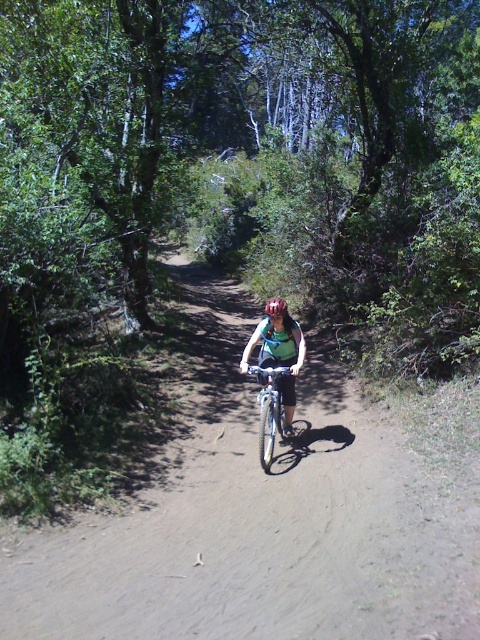
You are standing at the point marked by the coordinates point [271,412], which marks silver metallic bicycle at center. Can you see the silver metallic bicycle at center from this position?

Yes, the point marked by the coordinates point [271,412] marks the silver metallic bicycle at center, so you are standing exactly at the location of the silver metallic bicycle at center. Therefore, you can see the silver metallic bicycle at center from this position.

You are a photographer trying to capture a photo of the scene. You notice the matte green shirt at center and the silver metallic bicycle at center. Which object takes up more horizontal space in the image?

The matte green shirt at center takes up more horizontal space than the silver metallic bicycle at center because its width is larger.